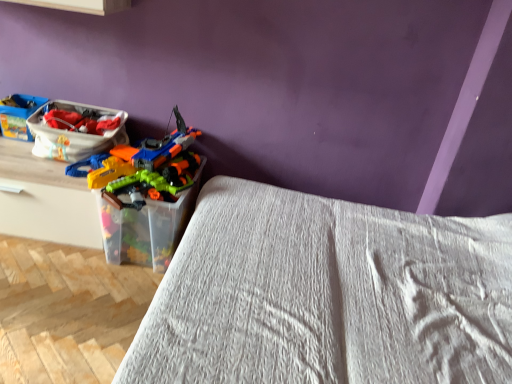
Identify the location of white textured bed at center. (327, 295).

Locate an element on the screen. This screenshot has height=384, width=512. matte plastic basket at upper left, positioned as the second kit in left-to-right order is located at coordinates (74, 133).

In order to face matte plastic toy boat at left, the second kit when ordered from right to left, should I rotate leftwards or rightwards?

You should look left and rotate roughly 28.349 degrees.

This screenshot has width=512, height=384. I want to click on white textured bed at center, so click(x=327, y=295).

What's the angular difference between matte plastic toy boat at left, marked as the first kit in a left-to-right arrangement, and matte plastic basket at upper left, positioned as the second kit in left-to-right order,'s facing directions?

3.73 degrees.

This screenshot has width=512, height=384. I want to click on kit to the right of matte plastic toy boat at left, the second kit when ordered from right to left, so tap(74, 133).

Is matte plastic toy boat at left, the second kit when ordered from right to left, placed right next to matte plastic basket at upper left, positioned as the second kit in left-to-right order?

No, matte plastic toy boat at left, the second kit when ordered from right to left, is not in contact with matte plastic basket at upper left, positioned as the second kit in left-to-right order.

Is translucent plastic container at center surrounding matte plastic toy boat at left, marked as the first kit in a left-to-right arrangement?

No, matte plastic toy boat at left, marked as the first kit in a left-to-right arrangement, is located outside of translucent plastic container at center.

Consider the image. From a real-world perspective, does translucent plastic container at center sit lower than matte plastic toy boat at left, marked as the first kit in a left-to-right arrangement?

Correct, in the physical world, translucent plastic container at center is lower than matte plastic toy boat at left, marked as the first kit in a left-to-right arrangement.

Which of these two, translucent plastic container at center or matte plastic toy boat at left, marked as the first kit in a left-to-right arrangement, is bigger?

With larger size is translucent plastic container at center.

Is point (125, 117) closer to camera compared to point (124, 167)?

No, (125, 117) is further to viewer.

Can you tell me how much matte plastic basket at upper left, positioned as the second kit in left-to-right order, and translucent plastic container at center differ in facing direction?

matte plastic basket at upper left, positioned as the second kit in left-to-right order, and translucent plastic container at center are facing 3.35 degrees away from each other.

In the scene shown: Looking at their sizes, would you say matte plastic basket at upper left, the first kit positioned from the right, is wider or thinner than translucent plastic container at center?

Considering their sizes, matte plastic basket at upper left, the first kit positioned from the right, looks slimmer than translucent plastic container at center.

How much distance is there between matte plastic basket at upper left, the first kit positioned from the right, and translucent plastic container at center?

matte plastic basket at upper left, the first kit positioned from the right, is 11.16 inches away from translucent plastic container at center.

Could you tell me if white textured bed at center is turned towards translucent plastic container at center?

Yes, white textured bed at center is turned towards translucent plastic container at center.

Considering the sizes of white textured bed at center and translucent plastic container at center in the image, is white textured bed at center wider or thinner than translucent plastic container at center?

Clearly, white textured bed at center has more width compared to translucent plastic container at center.

Which object is positioned more to the left, white textured bed at center or translucent plastic container at center?

From the viewer's perspective, translucent plastic container at center appears more on the left side.

From a real-world perspective, is white textured bed at center positioned under translucent plastic container at center based on gravity?

No.

Does matte plastic toy boat at left, the second kit when ordered from right to left, appear on the left side of translucent plastic container at center?

Yes.

Based on their sizes in the image, would you say matte plastic toy boat at left, marked as the first kit in a left-to-right arrangement, is bigger or smaller than translucent plastic container at center?

In the image, matte plastic toy boat at left, marked as the first kit in a left-to-right arrangement, appears to be smaller than translucent plastic container at center.

Considering the relative sizes of matte plastic toy boat at left, the second kit when ordered from right to left, and translucent plastic container at center in the image provided, is matte plastic toy boat at left, the second kit when ordered from right to left, taller than translucent plastic container at center?

Incorrect, the height of matte plastic toy boat at left, the second kit when ordered from right to left, is not larger of that of translucent plastic container at center.

Can you confirm if white textured bed at center is positioned to the right of matte plastic basket at upper left, positioned as the second kit in left-to-right order?

Yes.

Is white textured bed at center facing away from matte plastic basket at upper left, the first kit positioned from the right?

No, white textured bed at center's orientation is not away from matte plastic basket at upper left, the first kit positioned from the right.

Would you say white textured bed at center is inside or outside matte plastic basket at upper left, the first kit positioned from the right?

white textured bed at center lies outside matte plastic basket at upper left, the first kit positioned from the right.

From the image's perspective, is white textured bed at center positioned above or below matte plastic basket at upper left, the first kit positioned from the right?

white textured bed at center is situated lower than matte plastic basket at upper left, the first kit positioned from the right, in the image.

Is white textured bed at center shorter than matte plastic toy boat at left, the second kit when ordered from right to left?

In fact, white textured bed at center may be taller than matte plastic toy boat at left, the second kit when ordered from right to left.

Considering the relative positions of white textured bed at center and matte plastic toy boat at left, the second kit when ordered from right to left, in the image provided, is white textured bed at center to the left of matte plastic toy boat at left, the second kit when ordered from right to left, from the viewer's perspective?

No, white textured bed at center is not to the left of matte plastic toy boat at left, the second kit when ordered from right to left.

Find the location of `bed lying on the right of matte plastic toy boat at left, the second kit when ordered from right to left`. bed lying on the right of matte plastic toy boat at left, the second kit when ordered from right to left is located at coordinates (327, 295).

Where is `kit on the left of matte plastic basket at upper left, positioned as the second kit in left-to-right order`? This screenshot has height=384, width=512. kit on the left of matte plastic basket at upper left, positioned as the second kit in left-to-right order is located at coordinates (18, 115).

Where is `toy in front of the matte plastic toy boat at left, the second kit when ordered from right to left`? This screenshot has height=384, width=512. toy in front of the matte plastic toy boat at left, the second kit when ordered from right to left is located at coordinates (145, 195).

Which object lies further to the anchor point white textured bed at center, translucent plastic container at center or matte plastic basket at upper left, the first kit positioned from the right?

Among the two, matte plastic basket at upper left, the first kit positioned from the right, is located further to white textured bed at center.

From the image, which object appears to be farther from matte plastic toy boat at left, the second kit when ordered from right to left, matte plastic basket at upper left, the first kit positioned from the right, or translucent plastic container at center?

translucent plastic container at center is positioned further to the anchor matte plastic toy boat at left, the second kit when ordered from right to left.

Estimate the real-world distances between objects in this image. Which object is further from white textured bed at center, matte plastic toy boat at left, marked as the first kit in a left-to-right arrangement, or matte plastic basket at upper left, positioned as the second kit in left-to-right order?

matte plastic toy boat at left, marked as the first kit in a left-to-right arrangement, is further to white textured bed at center.

Looking at the image, which one is located further to matte plastic toy boat at left, marked as the first kit in a left-to-right arrangement, translucent plastic container at center or white textured bed at center?

The object further to matte plastic toy boat at left, marked as the first kit in a left-to-right arrangement, is white textured bed at center.

When comparing their distances from matte plastic toy boat at left, the second kit when ordered from right to left, does translucent plastic container at center or matte plastic basket at upper left, the first kit positioned from the right, seem further?

translucent plastic container at center lies further to matte plastic toy boat at left, the second kit when ordered from right to left, than the other object.

Which object lies further to the anchor point white textured bed at center, translucent plastic container at center or matte plastic toy boat at left, marked as the first kit in a left-to-right arrangement?

matte plastic toy boat at left, marked as the first kit in a left-to-right arrangement.

Looking at the image, which one is located further to translucent plastic container at center, matte plastic basket at upper left, the first kit positioned from the right, or matte plastic toy boat at left, marked as the first kit in a left-to-right arrangement?

matte plastic toy boat at left, marked as the first kit in a left-to-right arrangement, lies further to translucent plastic container at center than the other object.

Which object lies nearer to the anchor point matte plastic toy boat at left, marked as the first kit in a left-to-right arrangement, white textured bed at center or translucent plastic container at center?

translucent plastic container at center is closer to matte plastic toy boat at left, marked as the first kit in a left-to-right arrangement.

Locate an element on the screen. toy situated between matte plastic toy boat at left, marked as the first kit in a left-to-right arrangement, and white textured bed at center from left to right is located at coordinates (145, 195).

This screenshot has width=512, height=384. In order to click on kit between matte plastic toy boat at left, the second kit when ordered from right to left, and white textured bed at center from left to right in this screenshot , I will do `click(74, 133)`.

Where is `kit situated between matte plastic toy boat at left, marked as the first kit in a left-to-right arrangement, and translucent plastic container at center from left to right`? This screenshot has height=384, width=512. kit situated between matte plastic toy boat at left, marked as the first kit in a left-to-right arrangement, and translucent plastic container at center from left to right is located at coordinates tap(74, 133).

The image size is (512, 384). Identify the location of toy between matte plastic basket at upper left, positioned as the second kit in left-to-right order, and white textured bed at center from left to right. (145, 195).